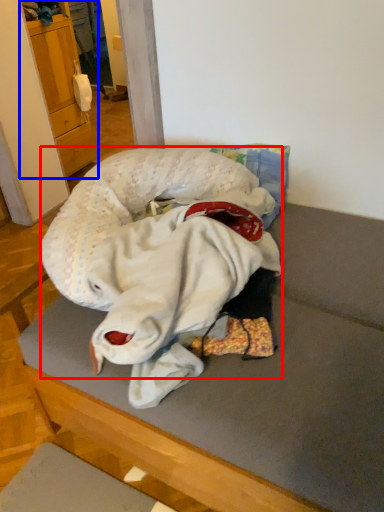
Question: Which object is closer to the camera taking this photo, baby (highlighted by a red box) or cabinetry (highlighted by a blue box)?

Choices:
 (A) baby
 (B) cabinetry

Answer: (A)